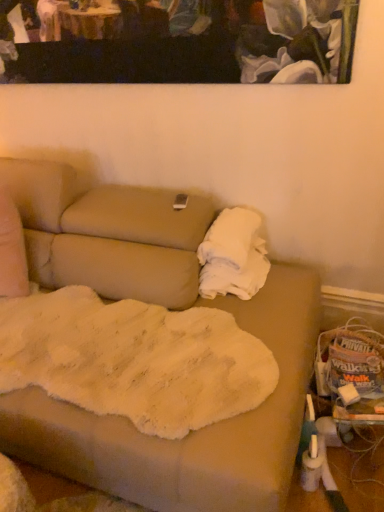
Question: Is white fluffy blanket at right facing away from painted canvas at upper center?

Choices:
 (A) yes
 (B) no

Answer: (B)

Question: From a real-world perspective, is white fluffy blanket at right on painted canvas at upper center?

Choices:
 (A) yes
 (B) no

Answer: (B)

Question: Considering the relative positions of white fluffy blanket at right and painted canvas at upper center in the image provided, is white fluffy blanket at right in front of painted canvas at upper center?

Choices:
 (A) no
 (B) yes

Answer: (A)

Question: Is white fluffy blanket at right far from painted canvas at upper center?

Choices:
 (A) yes
 (B) no

Answer: (B)

Question: Considering the relative positions of white fluffy blanket at right and painted canvas at upper center in the image provided, is white fluffy blanket at right to the right of painted canvas at upper center from the viewer's perspective?

Choices:
 (A) no
 (B) yes

Answer: (B)

Question: Could you tell me if white fluffy blanket at right is facing painted canvas at upper center?

Choices:
 (A) no
 (B) yes

Answer: (A)

Question: Is painted canvas at upper center positioned beyond the bounds of white fluffy blanket at right?

Choices:
 (A) yes
 (B) no

Answer: (A)

Question: Is painted canvas at upper center far away from white fluffy blanket at right?

Choices:
 (A) yes
 (B) no

Answer: (B)

Question: Considering the relative sizes of painted canvas at upper center and white fluffy blanket at right in the image provided, is painted canvas at upper center wider than white fluffy blanket at right?

Choices:
 (A) no
 (B) yes

Answer: (A)

Question: Does painted canvas at upper center appear on the left side of white fluffy blanket at right?

Choices:
 (A) no
 (B) yes

Answer: (B)

Question: From the image's perspective, is painted canvas at upper center below white fluffy blanket at right?

Choices:
 (A) yes
 (B) no

Answer: (B)

Question: Does painted canvas at upper center come behind white fluffy blanket at right?

Choices:
 (A) yes
 (B) no

Answer: (B)

Question: Based on their positions, is white fluffy blanket at right located to the left or right of painted canvas at upper center?

Choices:
 (A) right
 (B) left

Answer: (A)